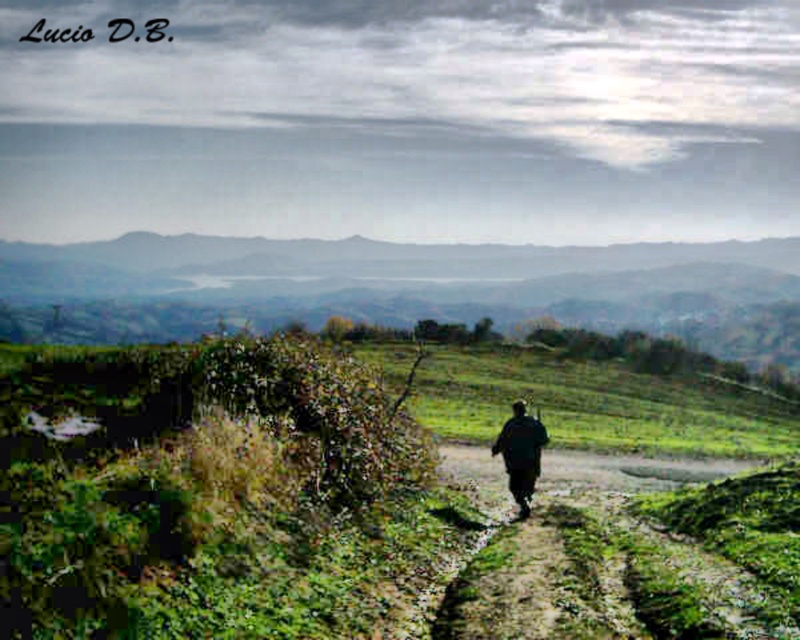
Question: Where is green grassy hill at center located in relation to dark green fabric at center in the image?

Choices:
 (A) left
 (B) right

Answer: (A)

Question: Which point appears closest to the camera in this image?

Choices:
 (A) (512, 419)
 (B) (629, 292)

Answer: (A)

Question: Is green grassy hill at center above dark green fabric at center?

Choices:
 (A) yes
 (B) no

Answer: (A)

Question: Can you confirm if green grassy hill at center is bigger than dark green fabric at center?

Choices:
 (A) no
 (B) yes

Answer: (B)

Question: Which object is closer to the camera taking this photo?

Choices:
 (A) dark green fabric at center
 (B) green grassy hill at center

Answer: (A)